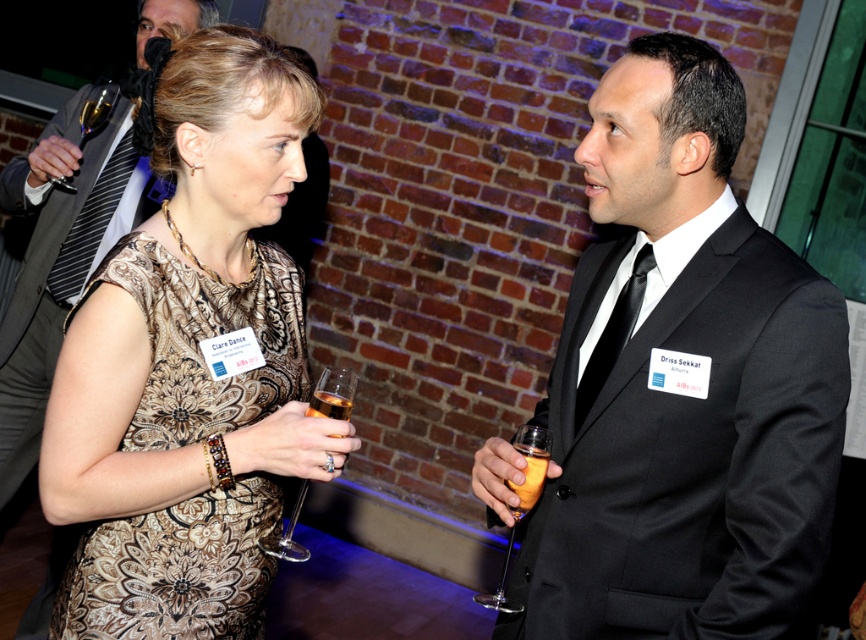
You are at a formal event and want to hand a document to the person wearing the black satin suit at right. You have the document on the translucent glass at center. To pass it to them without moving the glass, should you move the document to their left or right side?

The black satin suit at right is positioned on the right side of the translucent glass at center. Therefore, to pass the document to them without moving the glass, you should move the document to their left side.